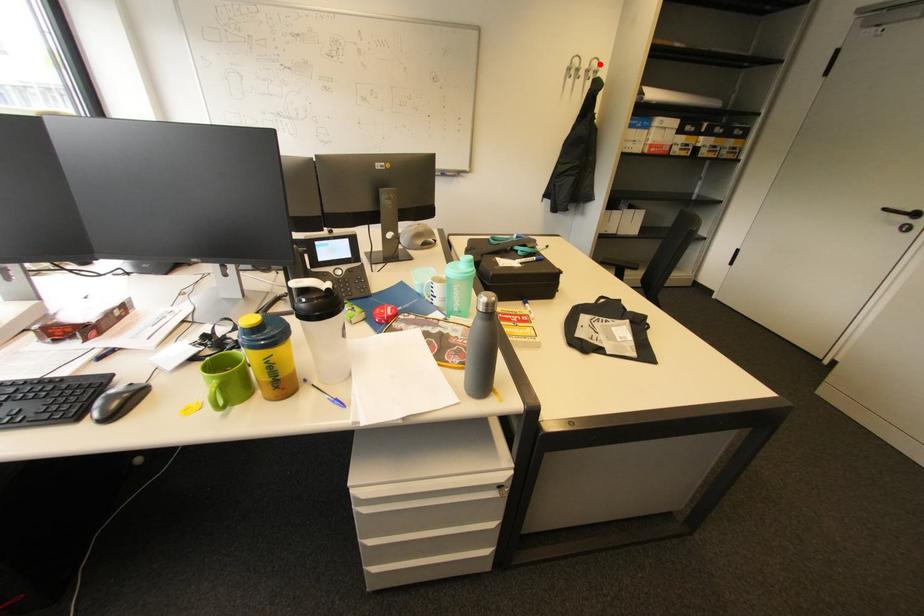
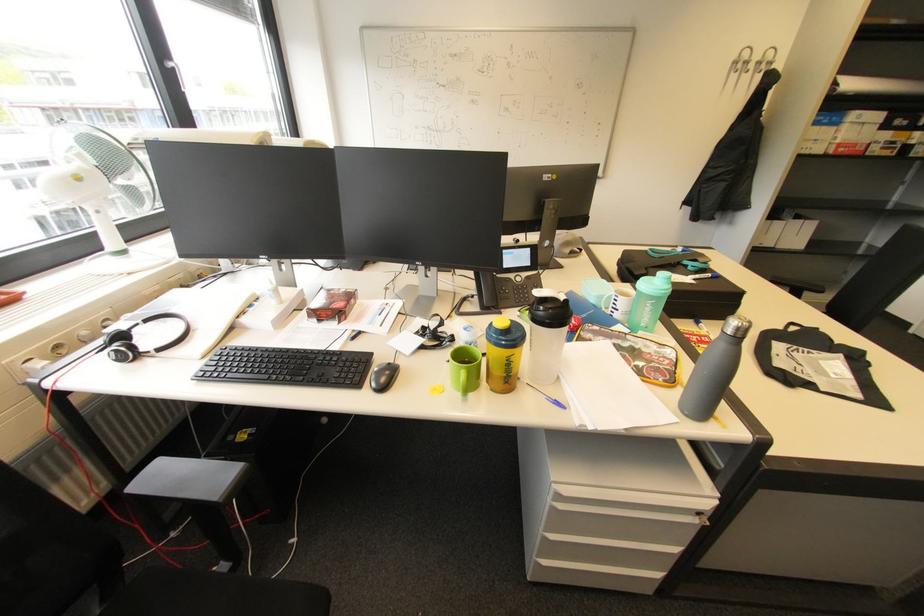
Find the pixel in the second image that matches the highlighted location in the first image.

(775, 55)